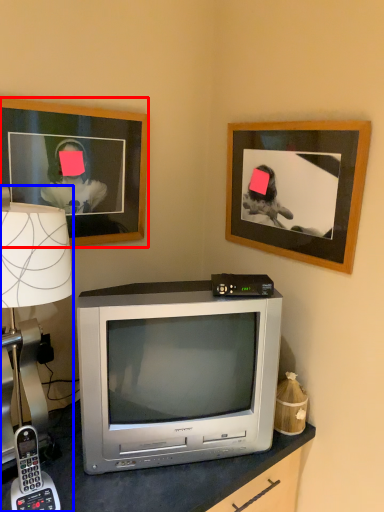
Question: Which object is further to the camera taking this photo, picture frame (highlighted by a red box) or lamp (highlighted by a blue box)?

Choices:
 (A) picture frame
 (B) lamp

Answer: (A)